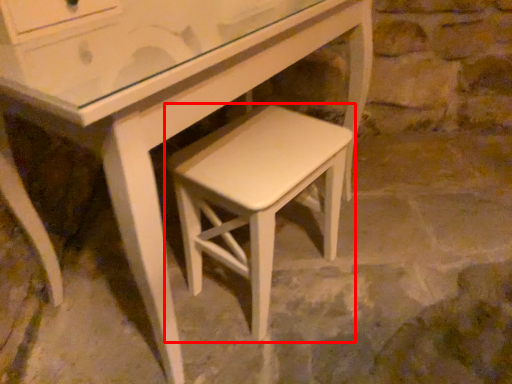
Question: In this image, where is stool (annotated by the red box) located relative to table?

Choices:
 (A) right
 (B) left

Answer: (B)